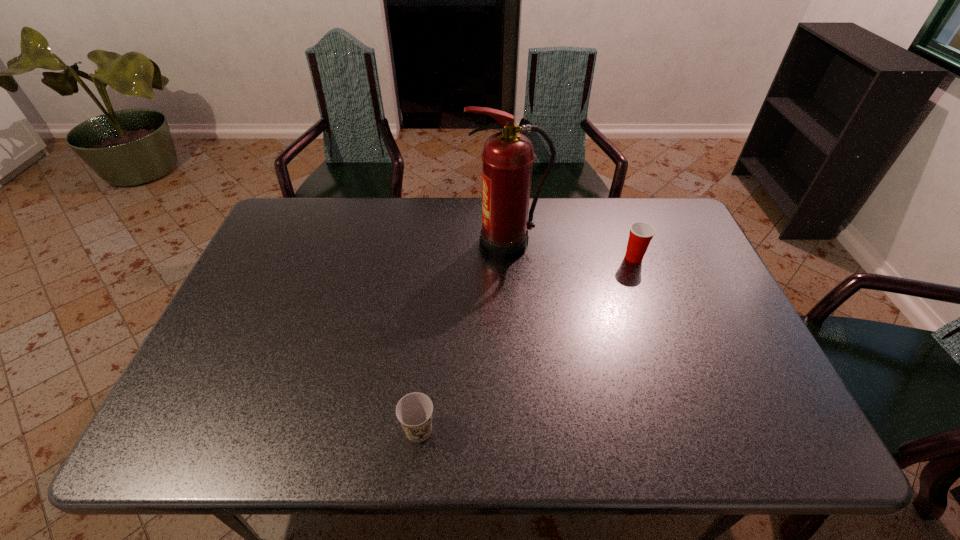
The width and height of the screenshot is (960, 540). I want to click on free location located on the left of the shorter Dixie cup, so click(378, 430).

This screenshot has width=960, height=540. What are the coordinates of `object at the far edge` in the screenshot? It's located at (507, 157).

Locate an element on the screen. object that is at the near edge is located at coordinates (414, 411).

You are a GUI agent. You are given a task and a screenshot of the screen. Output one action in this format:
    pyautogui.click(x=<x>, y=<y>)
    Task: Click on the vacant point at the far edge
    This screenshot has height=540, width=960.
    Given the screenshot: What is the action you would take?
    coord(324,227)

This screenshot has width=960, height=540. In order to click on vacant space at the near edge in this screenshot , I will do `click(458, 444)`.

The width and height of the screenshot is (960, 540). In the image, there is a desktop. What are the coordinates of `vacant region at the left edge` in the screenshot? It's located at (269, 317).

The image size is (960, 540). What are the coordinates of `free space at the right edge of the desktop` in the screenshot? It's located at click(770, 383).

Locate an element on the screen. vacant space at the far left corner of the desktop is located at coordinates (297, 215).

Find the location of a particular element. free region at the far right corner is located at coordinates (652, 220).

Identify the location of free region at the near right corner of the desktop. (754, 444).